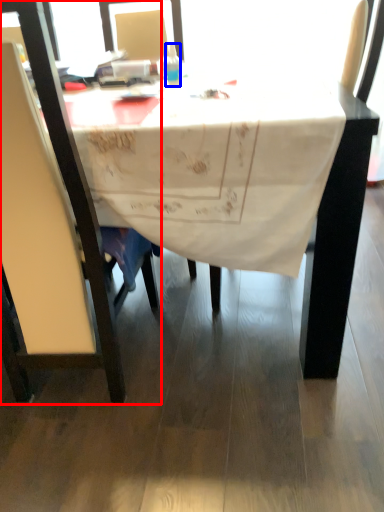
Question: Which object appears closest to the camera in this image, chair (highlighted by a red box) or bottle (highlighted by a blue box)?

Choices:
 (A) chair
 (B) bottle

Answer: (A)